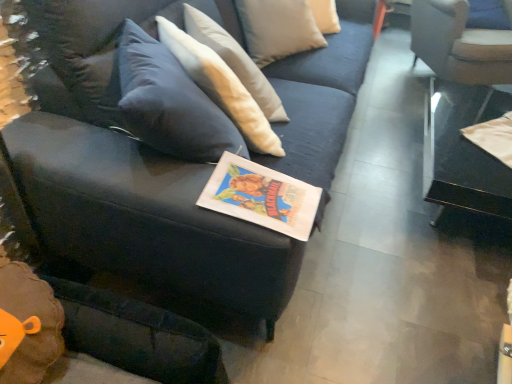
Find the location of a particular element. vacant area on top of matte paper book at center (from a real-world perspective) is located at coordinates (245, 179).